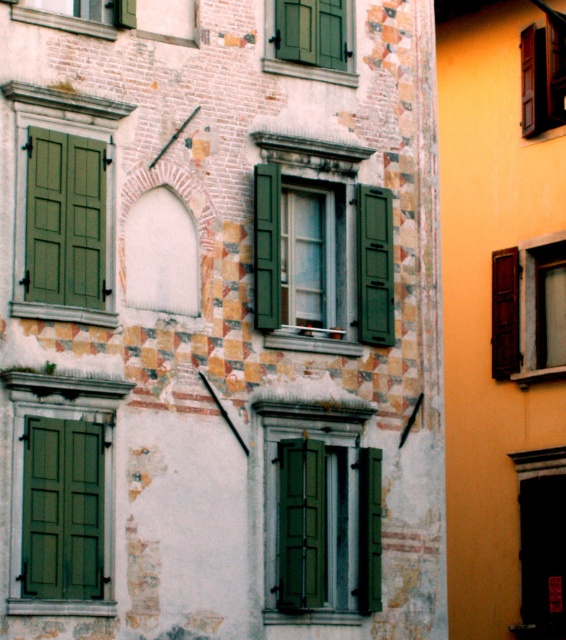
Question: Which of the following is the farthest from the observer?

Choices:
 (A) green wooden window at upper left
 (B) wooden shutters at right

Answer: (B)

Question: Can you confirm if green matte window at lower left is positioned below wooden shutters at right?

Choices:
 (A) no
 (B) yes

Answer: (B)

Question: Can you confirm if wooden shutters at right is smaller than smooth wooden door at center?

Choices:
 (A) yes
 (B) no

Answer: (B)

Question: Which point is farther to the camera?

Choices:
 (A) (542, 330)
 (B) (325, 68)
 (C) (62, 579)
 (D) (87, 214)

Answer: (A)

Question: Can you confirm if green matte shutters at left is bigger than green matte shutter at center?

Choices:
 (A) no
 (B) yes

Answer: (B)

Question: Estimate the real-world distances between objects in this image. Which object is closer to the green matte window at center?

Choices:
 (A) green wood window at center
 (B) green matte shutter at center

Answer: (A)